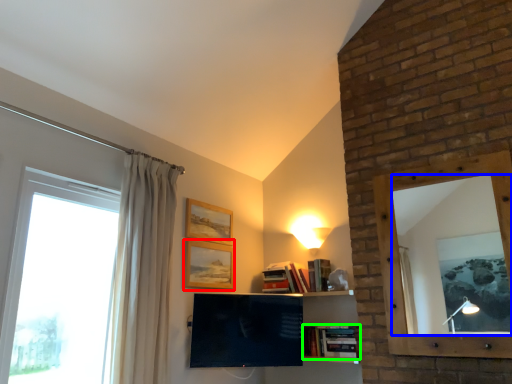
Question: Which object is the closest to the picture frame (highlighted by a red box)? Choose among these: mirror (highlighted by a blue box) or book (highlighted by a green box).

Choices:
 (A) mirror
 (B) book

Answer: (B)